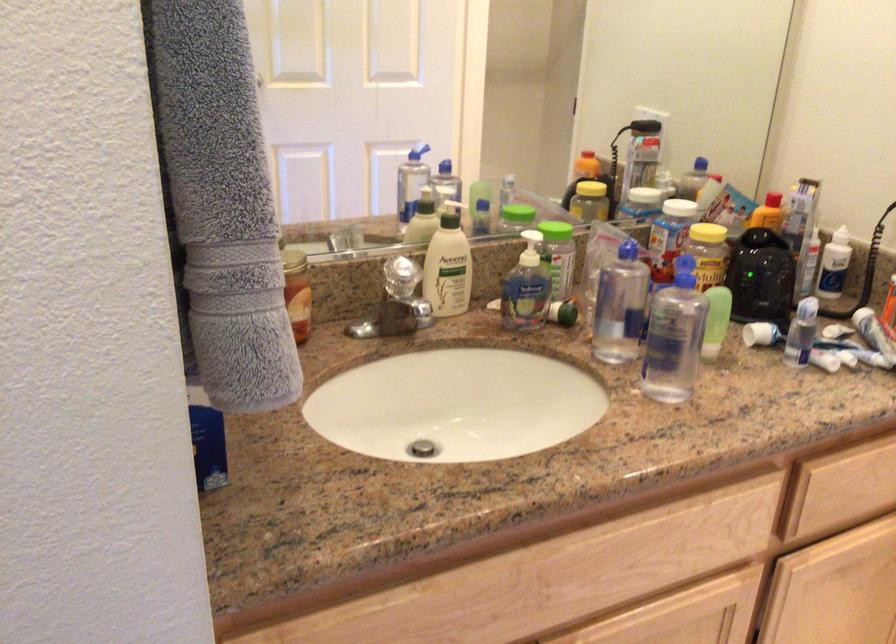
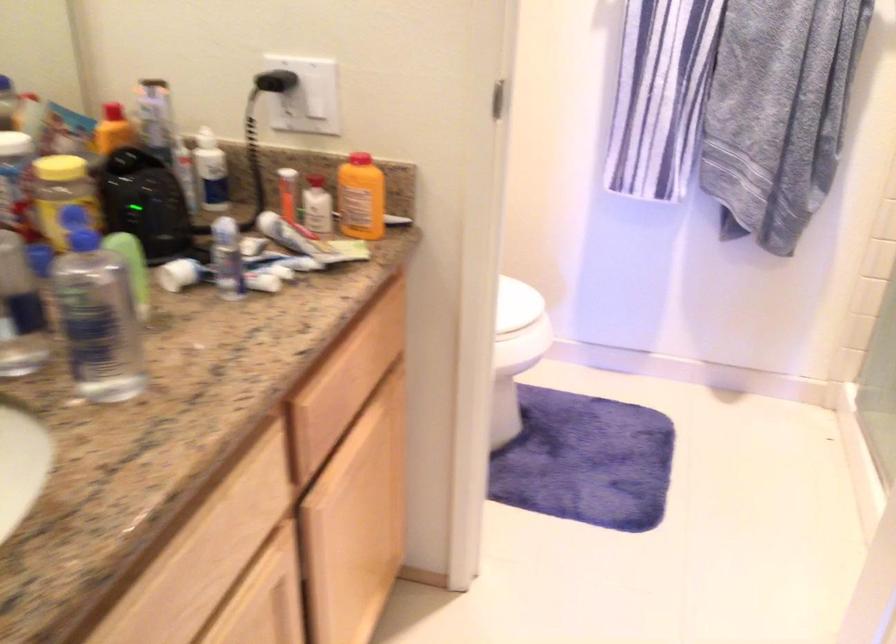
Question: The first image is from the beginning of the video and the second image is from the end. How did the camera likely rotate when shooting the video?

Choices:
 (A) Left
 (B) Right
 (C) Up
 (D) Down

Answer: (B)